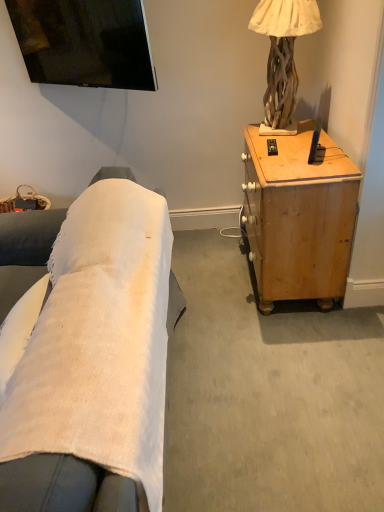
Where is `free spot in front of light brown wood desk at right`? free spot in front of light brown wood desk at right is located at coordinates (287, 354).